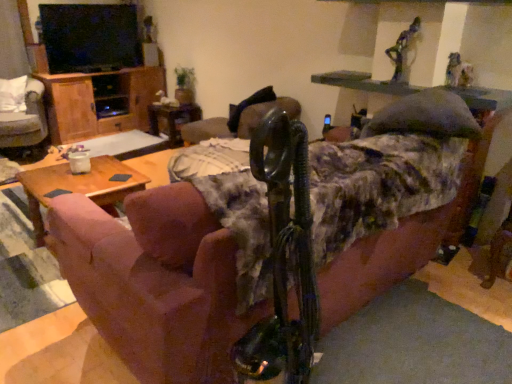
Question: Relative to pink fabric couch at center, is metallic statue at center, which is the 2th chair in left-to-right order, in front or behind?

Choices:
 (A) behind
 (B) front

Answer: (A)

Question: From their relative heights in the image, would you say metallic statue at center, which is the 2th chair in left-to-right order, is taller or shorter than pink fabric couch at center?

Choices:
 (A) short
 (B) tall

Answer: (A)

Question: Which of these objects is positioned closest to the metallic statue at center, which is the 1th chair from right to left?

Choices:
 (A) pink fabric couch at center
 (B) white fabric chair at left, positioned as the second chair in right-to-left order
 (C) wooden side table at center
 (D) woodenwoodentable at left
 (E) wooden cabinet at left

Answer: (C)

Question: Which object is positioned closest to the wooden cabinet at left?

Choices:
 (A) metallic statue at center, which is the 1th chair from right to left
 (B) pink fabric couch at center
 (C) woodenwoodentable at left
 (D) white fabric chair at left, the first chair viewed from the left
 (E) wooden side table at center

Answer: (D)